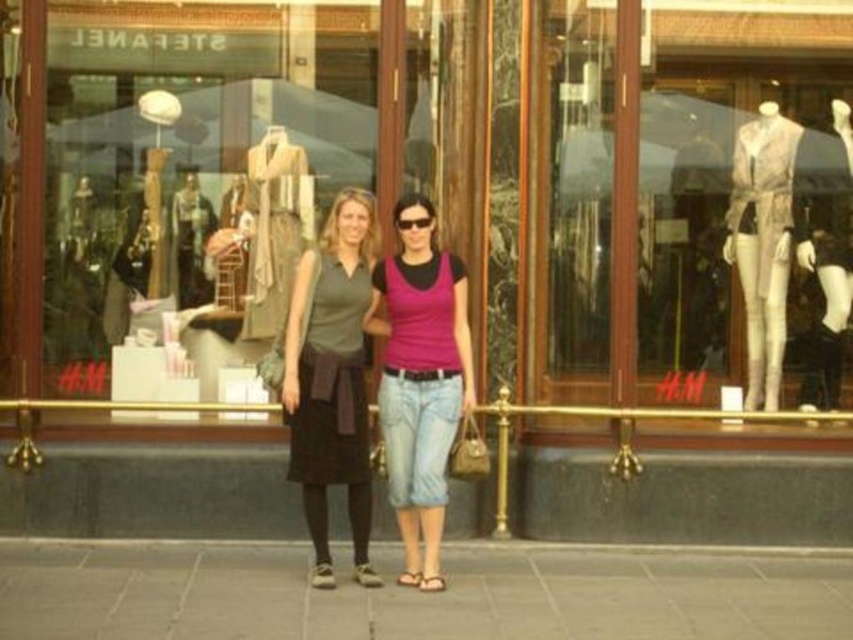
You are a photographer standing in front of the H M store. You see the matte glass display at center and the matte gray skirt at center. Which object is closer to the left side of the store window?

The matte glass display at center is closer to the left side of the store window because it is positioned to the left of the matte gray skirt at center.

Based on the photo, looking at the H M storefront, where is the matte glass display at center in relation to the pink matte tank top at center?

The matte glass display at center is located to the left of the pink matte tank top at center.